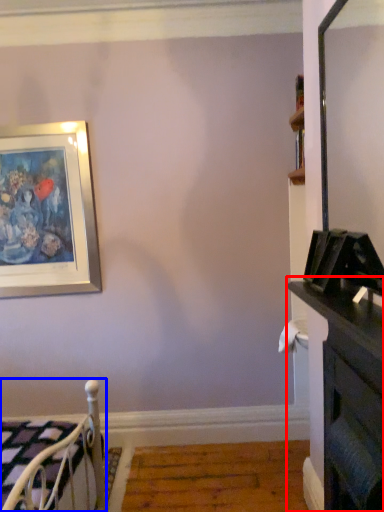
Question: Which object appears farthest to the camera in this image, dresser (highlighted by a red box) or furniture (highlighted by a blue box)?

Choices:
 (A) dresser
 (B) furniture

Answer: (B)